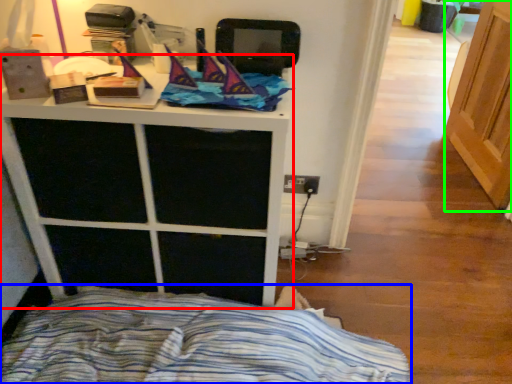
Question: Which object is the closest to the furniture (highlighted by a red box)? Choose among these: bed (highlighted by a blue box) or screen door (highlighted by a green box).

Choices:
 (A) bed
 (B) screen door

Answer: (A)